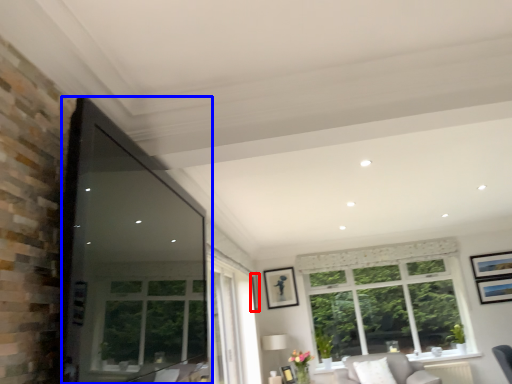
Question: Which of the following is the farthest to the observer, picture frame (highlighted by a red box) or window screen (highlighted by a blue box)?

Choices:
 (A) picture frame
 (B) window screen

Answer: (A)